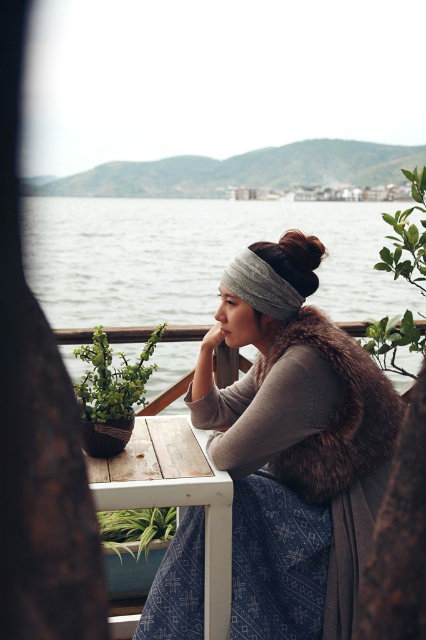
Does white wood table at center lie behind gray knitted headscarf at center?

No, it is not.

Who is more forward, (226, 492) or (267, 300)?

Point (226, 492) is in front.

Locate an element on the screen. The height and width of the screenshot is (640, 426). white wood table at center is located at coordinates (175, 497).

Is fuzzy brown vest at center positioned before green leafy plant at right?

Yes.

Is point (288, 332) farther from camera compared to point (406, 209)?

No, it is not.

Find the location of a particular element. The height and width of the screenshot is (640, 426). fuzzy brown vest at center is located at coordinates (293, 445).

Does clear water at upper center appear on the left side of green leafy plant at right?

Incorrect, clear water at upper center is not on the left side of green leafy plant at right.

Between clear water at upper center and green leafy plant at right, which one has more height?

Standing taller between the two is green leafy plant at right.

Between point (362, 305) and point (385, 355), which one is positioned in front?

Point (385, 355)

Where is `clear water at upper center`? The height and width of the screenshot is (640, 426). clear water at upper center is located at coordinates (193, 257).